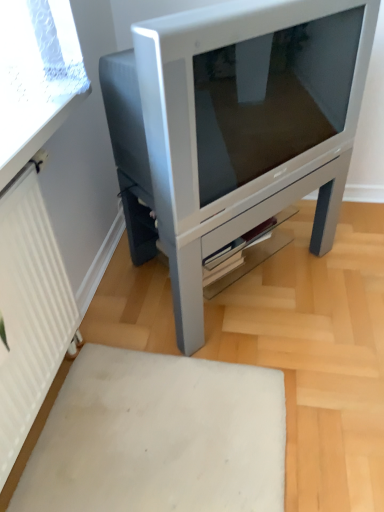
Find the location of a particular element. Image resolution: width=384 pixels, height=512 pixels. space that is in front of satin silver television at center is located at coordinates (234, 391).